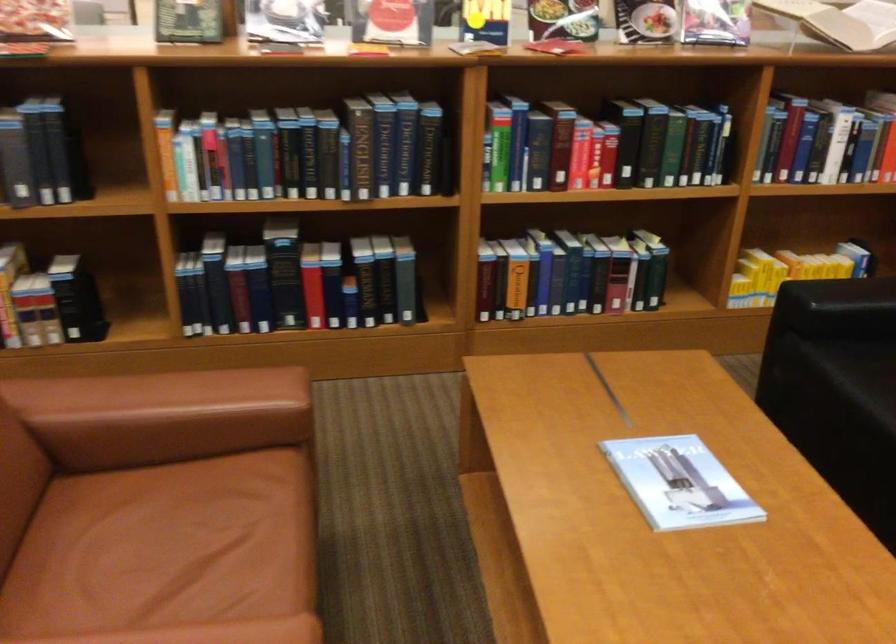
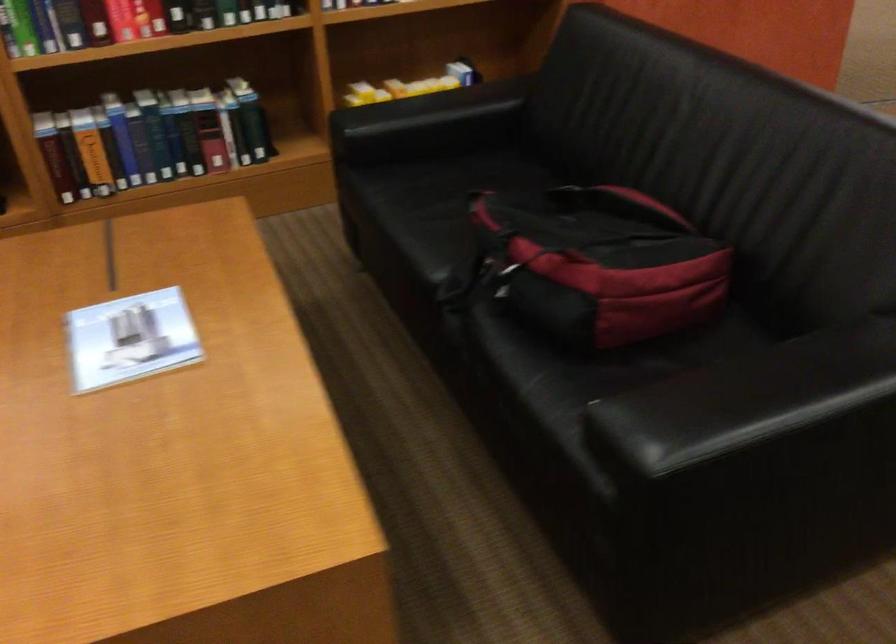
Question: The images are taken continuously from a first-person perspective. In which direction are you moving?

Choices:
 (A) Left
 (B) Right
 (C) Forward
 (D) Backward

Answer: (B)